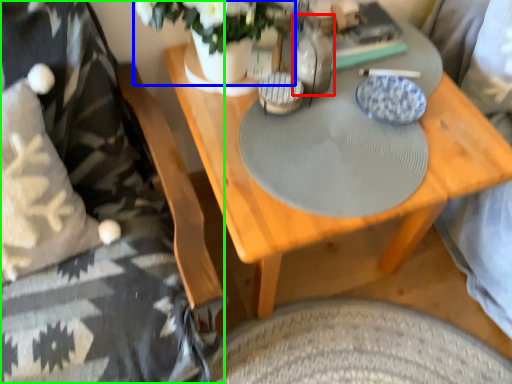
Question: Which object is positioned farthest from bottle (highlighted by a red box)? Select from floral arrangement (highlighted by a blue box) and bedding (highlighted by a green box).

Choices:
 (A) floral arrangement
 (B) bedding

Answer: (B)